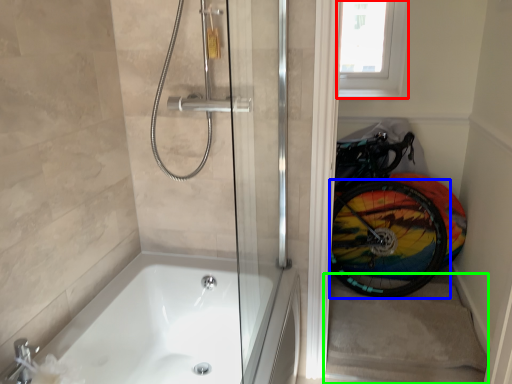
Question: Which object is the farthest from window screen (highlighted by a red box)? Choose among these: bicycle wheel (highlighted by a blue box) or stairwell (highlighted by a green box).

Choices:
 (A) bicycle wheel
 (B) stairwell

Answer: (B)